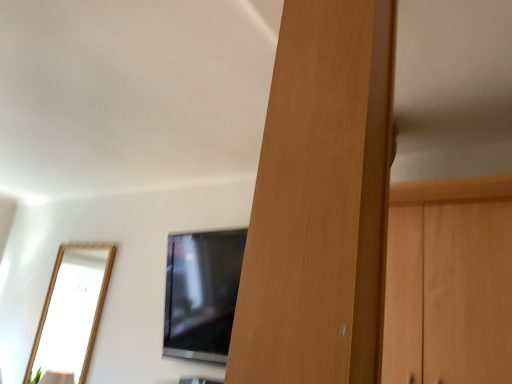
Question: Do you think wooden door at center is within black glossy tv at center, or outside of it?

Choices:
 (A) outside
 (B) inside

Answer: (A)

Question: From a real-world perspective, is wooden door at center physically located above or below black glossy tv at center?

Choices:
 (A) above
 (B) below

Answer: (A)

Question: From the image's perspective, is wooden door at center located above or below black glossy tv at center?

Choices:
 (A) above
 (B) below

Answer: (A)

Question: Looking at their shapes, would you say black glossy tv at center is wider or thinner than wooden door at center?

Choices:
 (A) thin
 (B) wide

Answer: (B)

Question: Considering their positions, is black glossy tv at center located in front of or behind wooden door at center?

Choices:
 (A) behind
 (B) front

Answer: (A)

Question: Looking at the image, does black glossy tv at center seem bigger or smaller compared to wooden door at center?

Choices:
 (A) big
 (B) small

Answer: (A)

Question: From a real-world perspective, is black glossy tv at center above or below wooden door at center?

Choices:
 (A) below
 (B) above

Answer: (A)